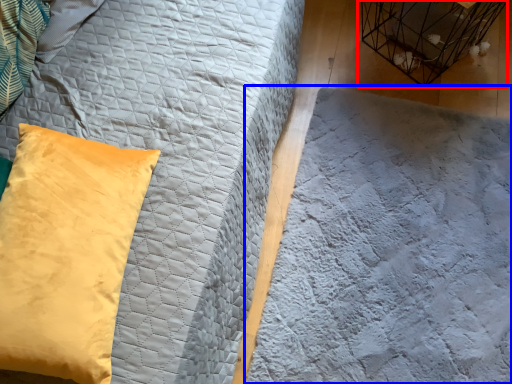
Question: Which point is closer to the camera, bird cage (highlighted by a red box) or sheet (highlighted by a blue box)?

Choices:
 (A) bird cage
 (B) sheet

Answer: (B)